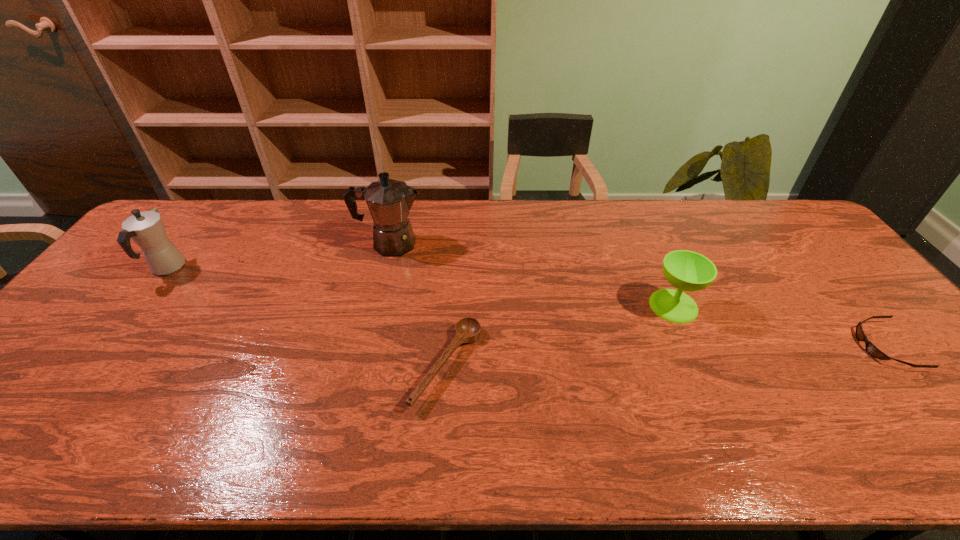
Where is `vacant area that lies between the shorter coffeepot and the tallest object`? Image resolution: width=960 pixels, height=540 pixels. vacant area that lies between the shorter coffeepot and the tallest object is located at coordinates (278, 256).

At what (x,y) coordinates should I click in order to perform the action: click on vacant space that's between the shortest object and the third object from right to left. Please return your answer as a coordinate pair (x, y). The width and height of the screenshot is (960, 540). Looking at the image, I should click on (666, 356).

At what (x,y) coordinates should I click in order to perform the action: click on free space between the shorter coffeepot and the third object from right to left. Please return your answer as a coordinate pair (x, y). The width and height of the screenshot is (960, 540). Looking at the image, I should click on (307, 316).

This screenshot has width=960, height=540. I want to click on blank region between the second shortest object and the shortest object, so click(x=666, y=356).

You are a GUI agent. You are given a task and a screenshot of the screen. Output one action in this format:
    pyautogui.click(x=<x>, y=<y>)
    Task: Click on the vacant region between the leftmost object and the rightmost object
    This screenshot has height=540, width=960.
    Given the screenshot: What is the action you would take?
    pyautogui.click(x=526, y=307)

Image resolution: width=960 pixels, height=540 pixels. Find the location of `free area in between the taller coffeepot and the second object from right to left`. free area in between the taller coffeepot and the second object from right to left is located at coordinates click(532, 275).

Identify which object is the third closest to the fourth object from left to right. Please provide its 2D coordinates. Your answer should be formatted as a tuple, i.e. [(x, y)], where the tuple contains the x and y coordinates of a point satisfying the conditions above.

[(389, 201)]

Locate which object is the second closest to the shorter coffeepot. Please provide its 2D coordinates. Your answer should be formatted as a tuple, i.e. [(x, y)], where the tuple contains the x and y coordinates of a point satisfying the conditions above.

[(467, 330)]

Find the location of `free spot that satisfies the following two spatial constraints: 1. on the pouring side of the taller coffeepot; 2. on the front side of the fourth shortest object`. free spot that satisfies the following two spatial constraints: 1. on the pouring side of the taller coffeepot; 2. on the front side of the fourth shortest object is located at coordinates (384, 268).

Locate an element on the screen. Image resolution: width=960 pixels, height=540 pixels. vacant space that satisfies the following two spatial constraints: 1. on the pouring side of the wooden spoon; 2. on the left side of the taller coffeepot is located at coordinates (361, 365).